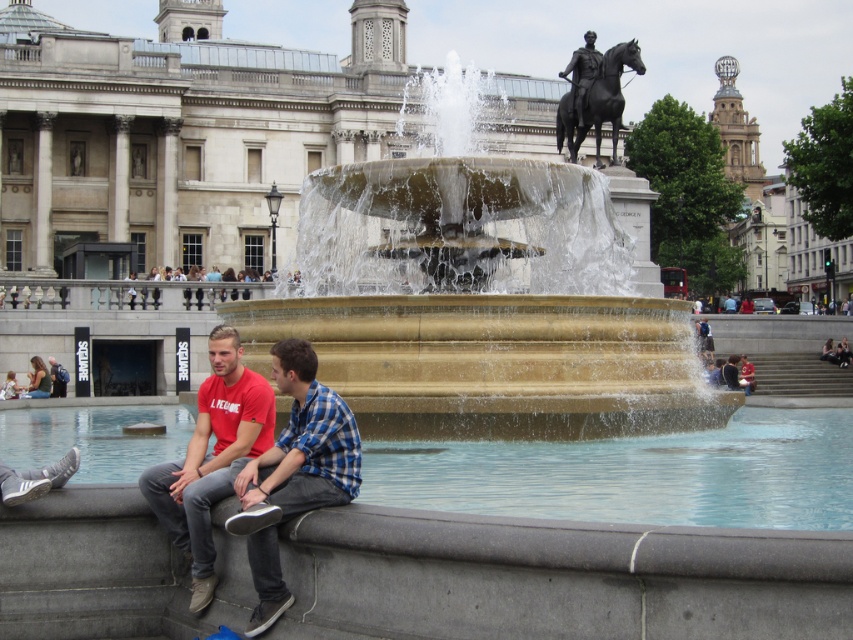
Who is higher up, red cotton shirt at lower left or matte black jacket at lower left?

Positioned higher is matte black jacket at lower left.

What do you see at coordinates (305, 442) in the screenshot?
I see `red cotton shirt at lower left` at bounding box center [305, 442].

Identify the location of red cotton shirt at lower left. This screenshot has width=853, height=640. (305, 442).

Can you confirm if matte red t-shirt at lower left is positioned below matte black jacket at lower left?

Yes.

Does matte red t-shirt at lower left lie behind matte black jacket at lower left?

No, it is in front of matte black jacket at lower left.

This screenshot has width=853, height=640. In order to click on matte red t-shirt at lower left in this screenshot , I will do `click(212, 458)`.

Is red cotton shirt at lower left further to the viewer compared to polished bronze statue at upper center?

No.

Which is more to the left, red cotton shirt at lower left or polished bronze statue at upper center?

Positioned to the left is red cotton shirt at lower left.

Identify the location of red cotton shirt at lower left. (305, 442).